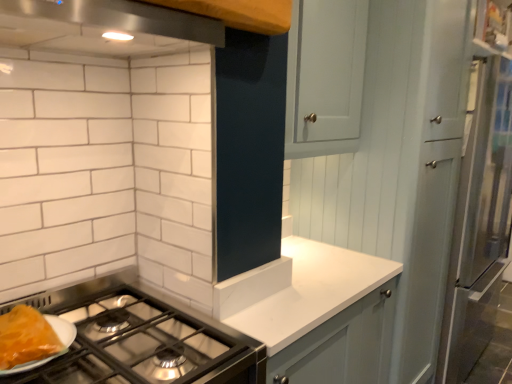
Measure the distance between point (105, 29) and camera.

1.10 meters.

You are a GUI agent. You are given a task and a screenshot of the screen. Output one action in this format:
    pyautogui.click(x=<x>, y=<y>)
    Task: Click on the stainless steel exhaust hood at upper center
    This screenshot has width=512, height=384.
    Given the screenshot: What is the action you would take?
    pyautogui.click(x=104, y=27)

The image size is (512, 384). Find the location of `shiny orange cheese at lower left`. shiny orange cheese at lower left is located at coordinates (26, 337).

Measure the distance between point (331, 263) and camera.

The distance of point (331, 263) from camera is 1.75 meters.

At what (x,y) coordinates should I click in order to perform the action: click on stainless steel exhaust hood at upper center. Please return your answer as a coordinate pair (x, y). The image size is (512, 384). Looking at the image, I should click on (104, 27).

From the image's perspective, which is above, white laminate countertop at center or shiny orange cheese at lower left?

From the image's view, shiny orange cheese at lower left is above.

Is white laminate countertop at center completely or partially outside of shiny orange cheese at lower left?

Indeed, white laminate countertop at center is completely outside shiny orange cheese at lower left.

Image resolution: width=512 pixels, height=384 pixels. In order to click on countertop below the shiny orange cheese at lower left (from a real-world perspective) in this screenshot , I will do `click(311, 291)`.

Considering the relative sizes of white laminate countertop at center and shiny orange cheese at lower left in the image provided, is white laminate countertop at center taller than shiny orange cheese at lower left?

Yes.

Is point (77, 46) closer to camera compared to point (293, 260)?

Yes, point (77, 46) is in front of point (293, 260).

From a real-world perspective, is stainless steel exhaust hood at upper center physically located above or below white laminate countertop at center?

From a real-world perspective, stainless steel exhaust hood at upper center is physically above white laminate countertop at center.

Is stainless steel exhaust hood at upper center far away from white laminate countertop at center?

No, stainless steel exhaust hood at upper center is not far away from white laminate countertop at center.

Is stainless steel exhaust hood at upper center bigger than shiny orange cheese at lower left?

Yes.

Is stainless steel exhaust hood at upper center positioned with its back to shiny orange cheese at lower left?

stainless steel exhaust hood at upper center does not have its back to shiny orange cheese at lower left.

Is there a large distance between stainless steel exhaust hood at upper center and shiny orange cheese at lower left?

No, there isn't a large distance between stainless steel exhaust hood at upper center and shiny orange cheese at lower left.

Is stainless steel exhaust hood at upper center inside or outside of shiny orange cheese at lower left?

stainless steel exhaust hood at upper center cannot be found inside shiny orange cheese at lower left.

Is shiny orange cheese at lower left wider than white laminate countertop at center?

No, shiny orange cheese at lower left is not wider than white laminate countertop at center.

Is shiny orange cheese at lower left facing towards white laminate countertop at center?

No, shiny orange cheese at lower left is not aimed at white laminate countertop at center.

Which object is more forward, shiny orange cheese at lower left or white laminate countertop at center?

Positioned in front is shiny orange cheese at lower left.

Would you say shiny orange cheese at lower left is to the left or to the right of white laminate countertop at center in the picture?

Based on their positions, shiny orange cheese at lower left is located to the left of white laminate countertop at center.

Is shiny orange cheese at lower left placed right next to stainless steel exhaust hood at upper center?

No.

From a real-world perspective, is shiny orange cheese at lower left under stainless steel exhaust hood at upper center?

Yes.

How far apart are shiny orange cheese at lower left and stainless steel exhaust hood at upper center?

shiny orange cheese at lower left is 29.13 inches away from stainless steel exhaust hood at upper center.

Is white laminate countertop at center positioned with its back to stainless steel exhaust hood at upper center?

No.

Does white laminate countertop at center have a smaller size compared to stainless steel exhaust hood at upper center?

Actually, white laminate countertop at center might be larger than stainless steel exhaust hood at upper center.

From the image's perspective, is white laminate countertop at center over stainless steel exhaust hood at upper center?

No, from the image's perspective, white laminate countertop at center is not over stainless steel exhaust hood at upper center.

Are white laminate countertop at center and stainless steel exhaust hood at upper center far apart?

white laminate countertop at center is actually quite close to stainless steel exhaust hood at upper center.

Find the location of a particular element. Image resolution: width=512 pixels, height=384 pixels. food located above the white laminate countertop at center (from a real-world perspective) is located at coordinates (26, 337).

The width and height of the screenshot is (512, 384). Identify the location of exhaust hood in front of the white laminate countertop at center. (104, 27).

Based on their spatial positions, is stainless steel exhaust hood at upper center or white laminate countertop at center further from shiny orange cheese at lower left?

The object further to shiny orange cheese at lower left is white laminate countertop at center.

From the image, which object appears to be nearer to white laminate countertop at center, shiny orange cheese at lower left or stainless steel exhaust hood at upper center?

Among the two, shiny orange cheese at lower left is located nearer to white laminate countertop at center.

From the image, which object appears to be farther from stainless steel exhaust hood at upper center, shiny orange cheese at lower left or white laminate countertop at center?

white laminate countertop at center lies further to stainless steel exhaust hood at upper center than the other object.

Looking at the image, which one is located closer to stainless steel exhaust hood at upper center, white laminate countertop at center or shiny orange cheese at lower left?

shiny orange cheese at lower left is positioned closer to the anchor stainless steel exhaust hood at upper center.

From the image, which object appears to be nearer to shiny orange cheese at lower left, white laminate countertop at center or stainless steel exhaust hood at upper center?

stainless steel exhaust hood at upper center lies closer to shiny orange cheese at lower left than the other object.

Based on their spatial positions, is stainless steel exhaust hood at upper center or shiny orange cheese at lower left further from white laminate countertop at center?

stainless steel exhaust hood at upper center lies further to white laminate countertop at center than the other object.

You are a GUI agent. You are given a task and a screenshot of the screen. Output one action in this format:
    pyautogui.click(x=<x>, y=<y>)
    Task: Click on the food between stainless steel exhaust hood at upper center and white laminate countertop at center from top to bottom
    This screenshot has height=384, width=512.
    Given the screenshot: What is the action you would take?
    pyautogui.click(x=26, y=337)